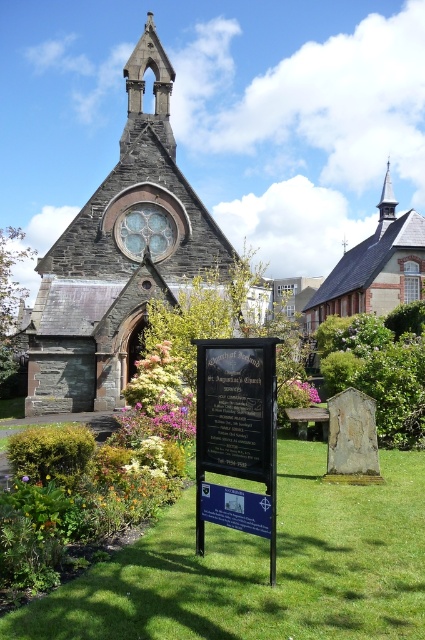
In the scene shown: Does dark gray stone church at center have a smaller size compared to wooden shingles chapel at upper right?

Indeed, dark gray stone church at center has a smaller size compared to wooden shingles chapel at upper right.

Describe the element at coordinates (119, 257) in the screenshot. I see `dark gray stone church at center` at that location.

You are a GUI agent. You are given a task and a screenshot of the screen. Output one action in this format:
    pyautogui.click(x=<x>, y=<y>)
    Task: Click on the dark gray stone church at center
    This screenshot has height=640, width=425.
    Given the screenshot: What is the action you would take?
    pyautogui.click(x=119, y=257)

Which of these two, dark gray stone church at center or purple matte flower at center, stands taller?

dark gray stone church at center

Can you confirm if dark gray stone church at center is taller than purple matte flower at center?

Yes, dark gray stone church at center is taller than purple matte flower at center.

Which is behind, point (62, 380) or point (27, 476)?

The point (62, 380) is behind.

Locate an element on the screen. dark gray stone church at center is located at coordinates (119, 257).

From the picture: Who is higher up, dark gray stone church at center or black polished stone sign at center?

dark gray stone church at center is above.

Between dark gray stone church at center and black polished stone sign at center, which one has more height?

dark gray stone church at center

Identify the location of dark gray stone church at center. (119, 257).

The image size is (425, 640). Identify the location of dark gray stone church at center. (119, 257).